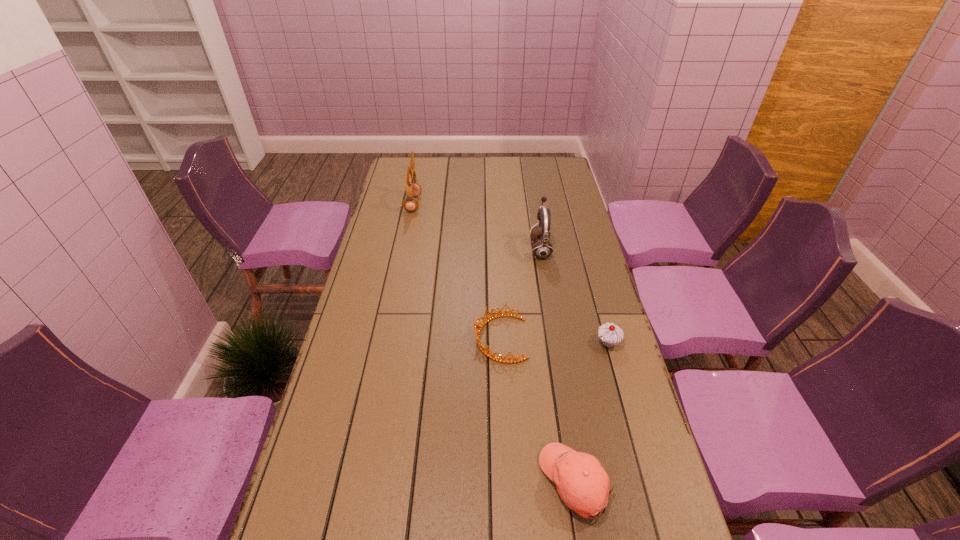
I want to click on vacant space located on the ear pads of the right earphone, so click(x=499, y=249).

Identify the location of blank space located on the ear pads of the right earphone. The height and width of the screenshot is (540, 960). (457, 249).

At what (x,y) coordinates should I click in order to perform the action: click on vacant space situated 0.300m on the left of the third tallest object. Please return your answer as a coordinate pair (x, y). This screenshot has width=960, height=540. Looking at the image, I should click on (497, 343).

Identify the location of vacant space located on the back of the nearest object. (551, 327).

Identify the location of free space located 0.350m on the front-facing side of the tiara. (360, 339).

Locate an element on the screen. The image size is (960, 540). free region located on the front-facing side of the tiara is located at coordinates (389, 339).

The image size is (960, 540). In order to click on vacant space located on the front-facing side of the tiara in this screenshot , I will do pyautogui.click(x=350, y=339).

Locate an element on the screen. The width and height of the screenshot is (960, 540). object that is at the left edge is located at coordinates (413, 189).

The height and width of the screenshot is (540, 960). What are the coordinates of `earphone that is at the right edge` in the screenshot? It's located at (542, 249).

Identify the location of cupcake that is at the right edge. (610, 334).